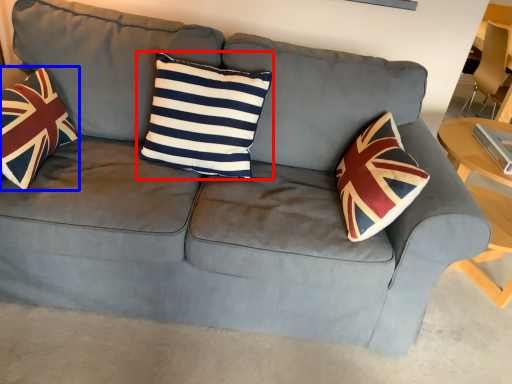
Question: Which of the following is the closest to the observer, pillow (highlighted by a red box) or throw pillow (highlighted by a blue box)?

Choices:
 (A) pillow
 (B) throw pillow

Answer: (B)